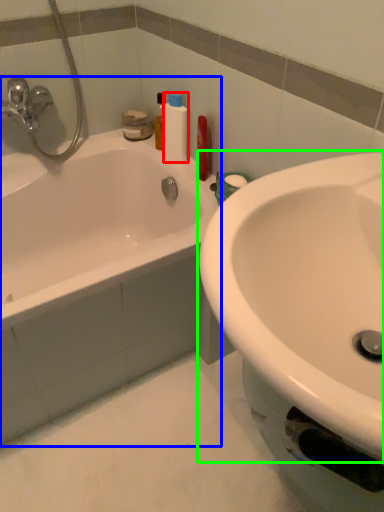
Question: Based on their relative distances, which object is farther from cleaning product (highlighted by a red box)? Choose from bathtub (highlighted by a blue box) and sink (highlighted by a green box).

Choices:
 (A) bathtub
 (B) sink

Answer: (B)